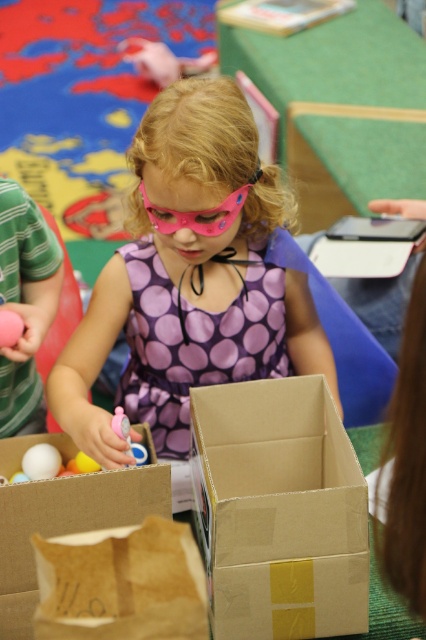
Question: Among these points, which one is nearest to the camera?

Choices:
 (A) (138, 259)
 (B) (51, 451)
 (C) (233, 221)

Answer: (B)

Question: Which object is the farthest from the white matte egg at center?

Choices:
 (A) brown paper bag at lower left
 (B) brown cardboard box at center
 (C) pink fabric mask at center

Answer: (A)

Question: Among these points, which one is farthest from the camera?

Choices:
 (A) (2, 609)
 (B) (239, 202)
 (C) (34, 458)
 (D) (129, 432)

Answer: (C)

Question: Does pink fabric mask at center lie behind purple dotted dress at center?

Choices:
 (A) yes
 (B) no

Answer: (B)

Question: Where is pink felt goggles at center located in relation to white matte egg at center in the image?

Choices:
 (A) right
 (B) left

Answer: (A)

Question: Does cardboard box at center appear over pink felt goggles at center?

Choices:
 (A) no
 (B) yes

Answer: (A)